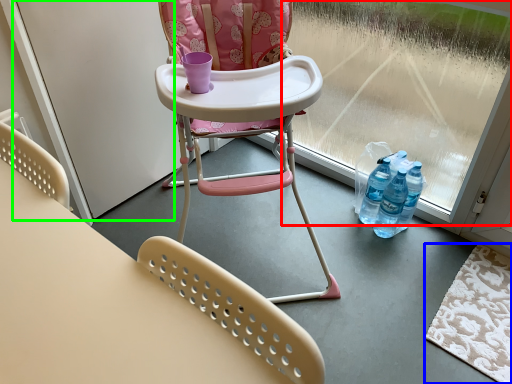
Question: Based on their relative distances, which object is farther from window screen (highlighted by a red box)? Choose from mat (highlighted by a blue box) and screen door (highlighted by a green box).

Choices:
 (A) mat
 (B) screen door

Answer: (B)